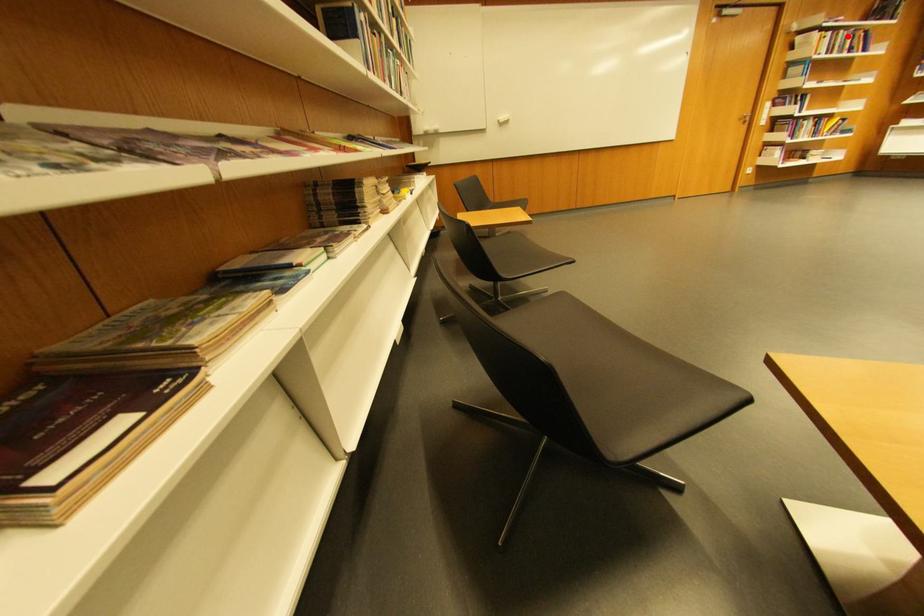
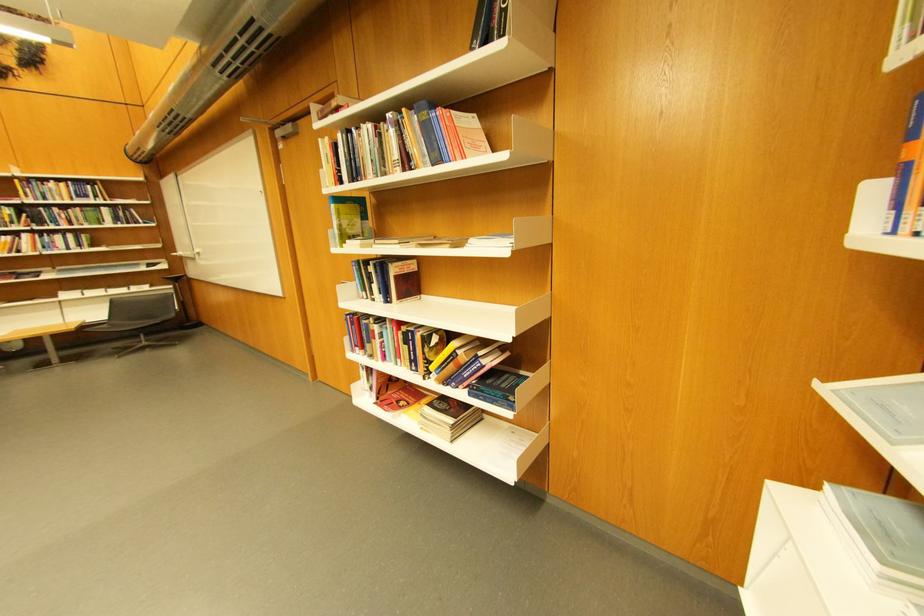
Locate, in the second image, the point that corresponds to the highlighted location in the first image.

(370, 137)